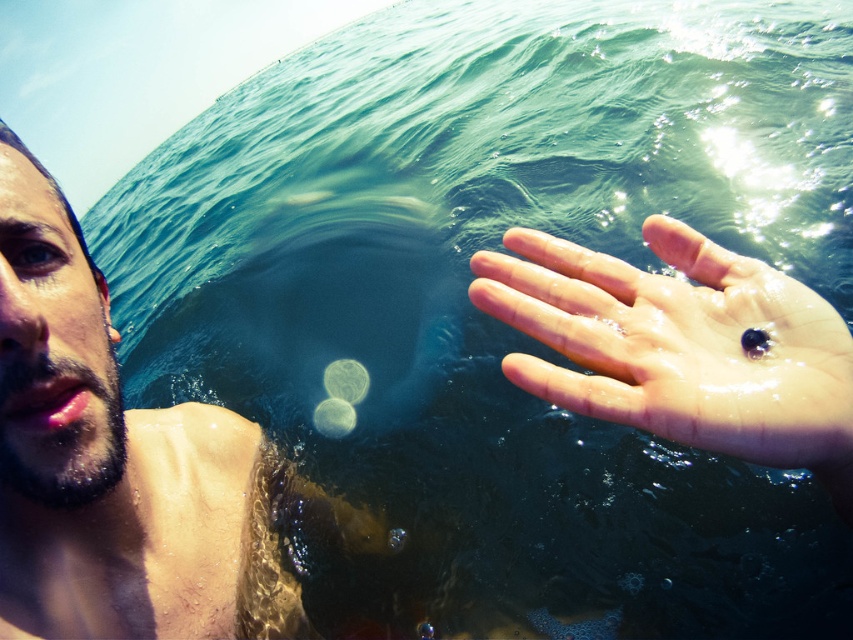
You are a photographer trying to capture the reflection of the person in the water. Since you want to focus on the hand, which object should you adjust your camera to be closer to? The shiny wet skin at left or the glossy skin hand at right?

The glossy skin hand at right is behind the shiny wet skin at left, so to focus on the hand, adjust the camera closer to the glossy skin hand at right to avoid obstruction by the shiny wet skin at left.

Consider the image. You are a photographer trying to capture the reflection of the person in the water. Which object, the shiny wet skin at left or the glossy skin hand at right, would have a larger reflection on the water surface?

The shiny wet skin at left would have a larger reflection on the water surface because it is bigger than the glossy skin hand at right.

You are a photographer trying to capture the reflection of the shiny wet skin at left in the water. Based on the scene, where should you position your camera to best capture this reflection?

To capture the reflection of the shiny wet skin at left, position the camera at the same height as the shiny wet skin at left since reflections are typically seen when the camera is at the same level as the object.